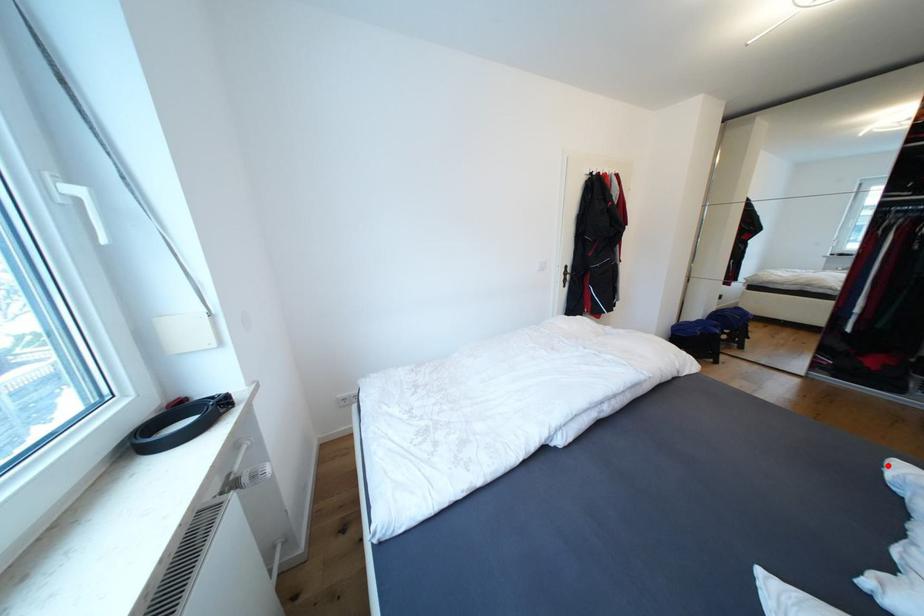
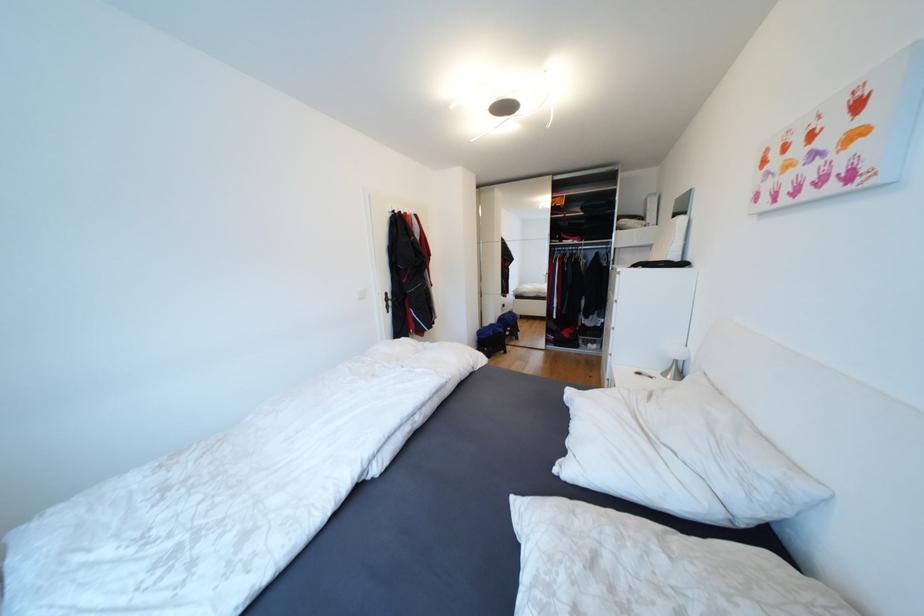
Question: I am providing you with two images of the same scene from different viewpoints. Given a red point in image1, look at the same physical point in image2. Is it:

Choices:
 (A) Closer to the viewpoint
 (B) Farther from the viewpoint

Answer: (A)